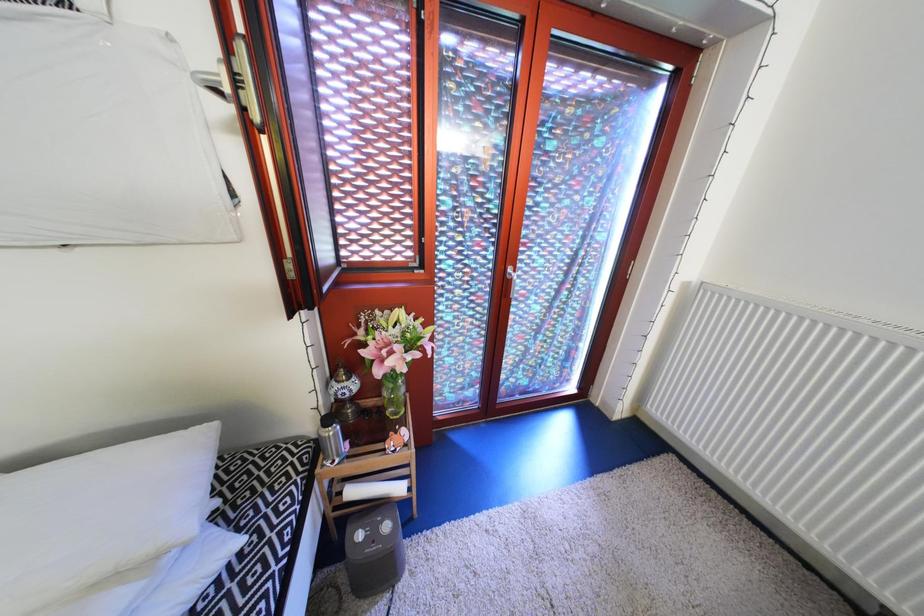
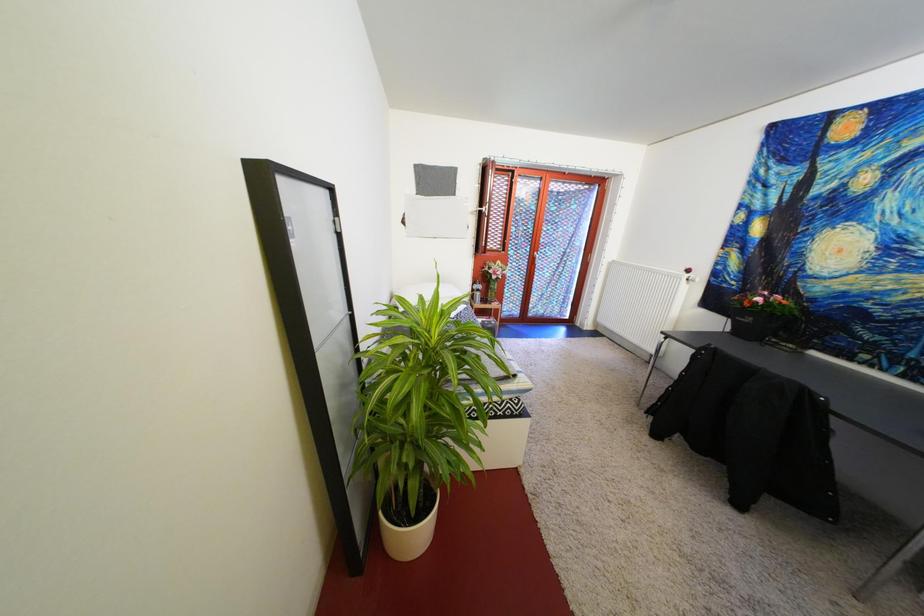
Question: What movement of the cameraman would produce the second image?

Choices:
 (A) Left
 (B) Right
 (C) Forward
 (D) Backward

Answer: (D)